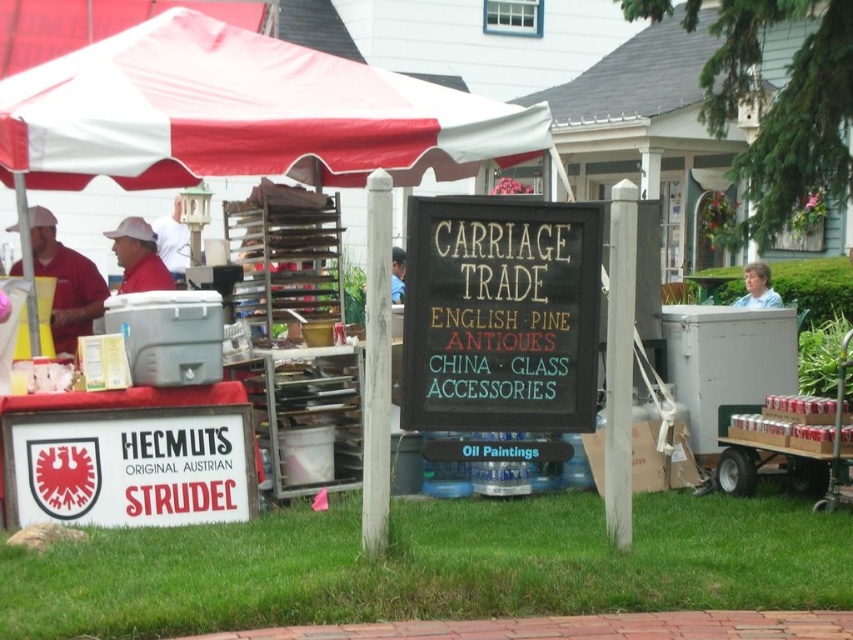
You are a customer at the outdoor market and want to buy a souvenir. The vendor has a metallic silver cart at right and a matte red shirt at left. Which item can you purchase in a bigger size?

The metallic silver cart at right has a larger size compared to the matte red shirt at left, so you can purchase the metallic silver cart at right in a bigger size.